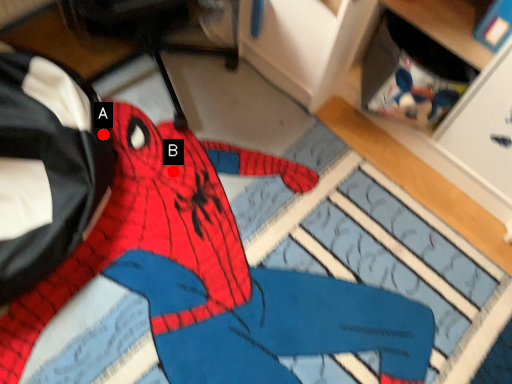
Question: Two points are circled on the image, labeled by A and B beside each circle. Which point is further to the camera?

Choices:
 (A) A is further
 (B) B is further

Answer: (B)